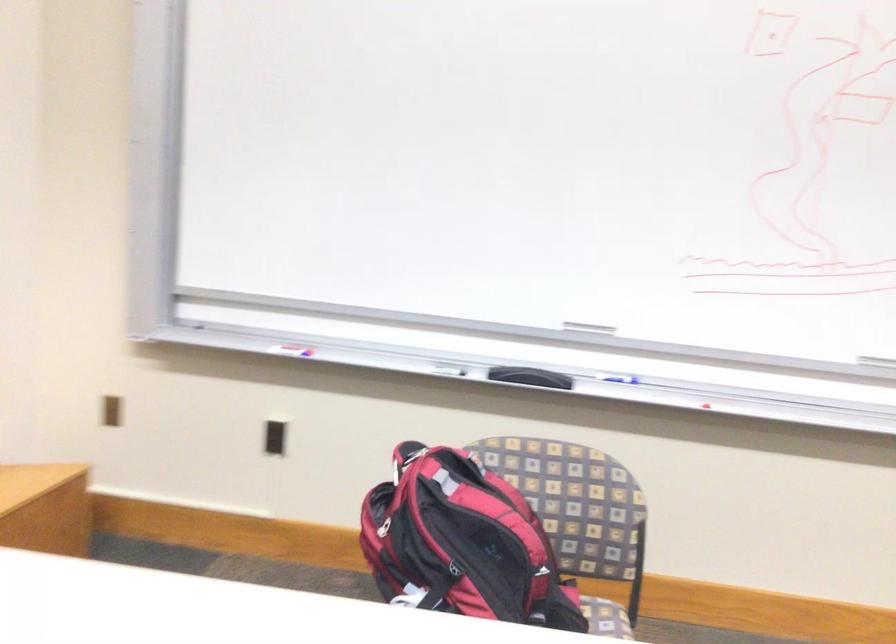
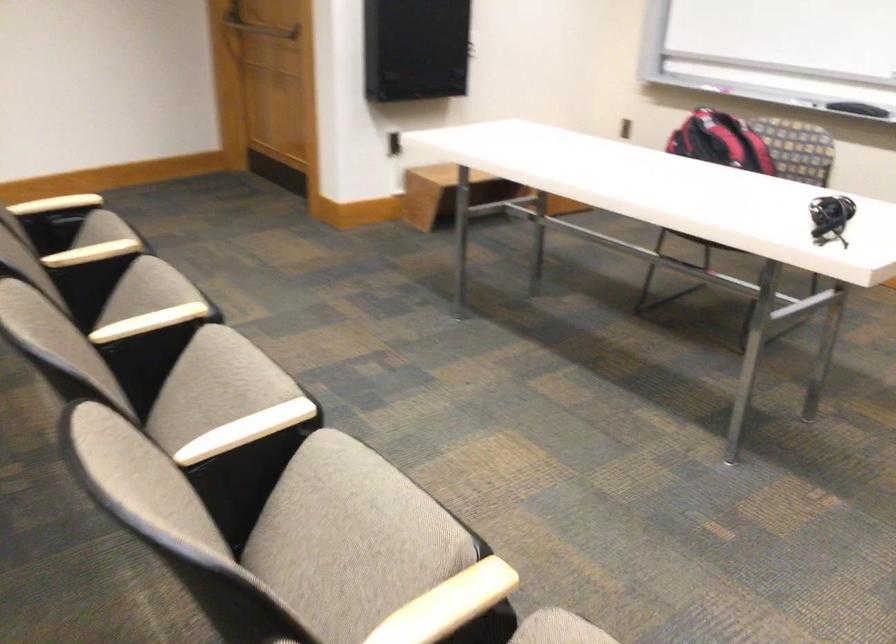
Question: I am providing you with two images of the same scene from different viewpoints. Which of the following objects are not visible in image2?

Choices:
 (A) door push bar
 (B) black wall outlet
 (C) slatted door handle
 (D) chair armrest

Answer: (B)